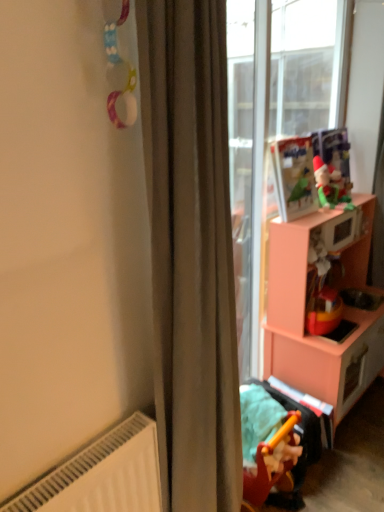
The image size is (384, 512). What do you see at coordinates (330, 186) in the screenshot? I see `matte plastic toy at upper right, acting as the 1th toy starting from the back` at bounding box center [330, 186].

What is the approximate width of yellow plastic toy at lower right, marked as the first toy in a left-to-right arrangement?

yellow plastic toy at lower right, marked as the first toy in a left-to-right arrangement, is 9.42 inches wide.

Describe the element at coordinates (266, 442) in the screenshot. This screenshot has width=384, height=512. I see `yellow plastic toy at lower right, the 2th toy in the back-to-front sequence` at that location.

Identify the location of matte plastic toy at upper right, arranged as the first toy when viewed from the right. Image resolution: width=384 pixels, height=512 pixels. (330, 186).

Where is `the 1st toy to the right of the satin beige curtain at center, starting your count from the anchor`? The image size is (384, 512). the 1st toy to the right of the satin beige curtain at center, starting your count from the anchor is located at coordinates (266, 442).

From the image's perspective, between yellow plastic toy at lower right, marked as the first toy in a left-to-right arrangement, and satin beige curtain at center, which one is located above?

satin beige curtain at center.

Is yellow plastic toy at lower right, which ranks as the 1th toy in bottom-to-top order, oriented towards satin beige curtain at center?

Yes, yellow plastic toy at lower right, which ranks as the 1th toy in bottom-to-top order, is oriented towards satin beige curtain at center.

Based on their sizes in the image, would you say yellow plastic toy at lower right, marked as the second toy in a top-to-bottom arrangement, is bigger or smaller than satin beige curtain at center?

Clearly, yellow plastic toy at lower right, marked as the second toy in a top-to-bottom arrangement, is smaller in size than satin beige curtain at center.

Does point (224, 179) come behind point (318, 178)?

That is False.

Can you tell me how much satin beige curtain at center and matte plastic toy at upper right, the 2th toy viewed from the left, differ in facing direction?

The angle between the facing direction of satin beige curtain at center and the facing direction of matte plastic toy at upper right, the 2th toy viewed from the left, is 1.34 degrees.

Relative to matte plastic toy at upper right, which ranks as the first toy in top-to-bottom order, is satin beige curtain at center in front or behind?

Clearly, satin beige curtain at center is in front of matte plastic toy at upper right, which ranks as the first toy in top-to-bottom order.

From a real-world perspective, which is physically above, satin beige curtain at center or matte plastic toy at upper right, which ranks as the first toy in top-to-bottom order?

From a 3D spatial view, matte plastic toy at upper right, which ranks as the first toy in top-to-bottom order, is above.

From a real-world perspective, is satin beige curtain at center over yellow plastic toy at lower right, the first toy positioned from the front?

Yes.

Between satin beige curtain at center and yellow plastic toy at lower right, marked as the second toy in a top-to-bottom arrangement, which one appears on the right side from the viewer's perspective?

yellow plastic toy at lower right, marked as the second toy in a top-to-bottom arrangement, is more to the right.

Is yellow plastic toy at lower right, marked as the first toy in a left-to-right arrangement, completely or partially inside satin beige curtain at center?

No.

Is yellow plastic toy at lower right, marked as the first toy in a left-to-right arrangement, wider or thinner than matte plastic toy at upper right, which is the 2th toy in bottom-to-top order?

Considering their sizes, yellow plastic toy at lower right, marked as the first toy in a left-to-right arrangement, looks broader than matte plastic toy at upper right, which is the 2th toy in bottom-to-top order.

From a real-world perspective, relative to matte plastic toy at upper right, which ranks as the first toy in top-to-bottom order, is yellow plastic toy at lower right, marked as the first toy in a left-to-right arrangement, vertically above or below?

Clearly, from a real-world perspective, yellow plastic toy at lower right, marked as the first toy in a left-to-right arrangement, is below matte plastic toy at upper right, which ranks as the first toy in top-to-bottom order.

Considering the relative sizes of yellow plastic toy at lower right, the first toy positioned from the front, and matte plastic toy at upper right, which is counted as the 2th toy, starting from the front, in the image provided, is yellow plastic toy at lower right, the first toy positioned from the front, smaller than matte plastic toy at upper right, which is counted as the 2th toy, starting from the front,?

No, yellow plastic toy at lower right, the first toy positioned from the front, is not smaller than matte plastic toy at upper right, which is counted as the 2th toy, starting from the front.

Is matte plastic toy at upper right, arranged as the first toy when viewed from the right, oriented away from pink matte cabinet at right?

No, matte plastic toy at upper right, arranged as the first toy when viewed from the right,'s orientation is not away from pink matte cabinet at right.

Do you think matte plastic toy at upper right, which is the 2th toy in bottom-to-top order, is within pink matte cabinet at right, or outside of it?

matte plastic toy at upper right, which is the 2th toy in bottom-to-top order, is located beyond the bounds of pink matte cabinet at right.

Find the location of a particular element. This screenshot has width=384, height=512. toy located behind the pink matte cabinet at right is located at coordinates (330, 186).

Does point (318, 157) come in front of point (383, 355)?

Yes, point (318, 157) is in front of point (383, 355).

At what (x,y) coordinates should I click in order to perform the action: click on toy lying below the pink matte cabinet at right (from the image's perspective). Please return your answer as a coordinate pair (x, y). The width and height of the screenshot is (384, 512). Looking at the image, I should click on (266, 442).

Can you confirm if yellow plastic toy at lower right, marked as the first toy in a left-to-right arrangement, is thinner than pink matte cabinet at right?

Indeed, yellow plastic toy at lower right, marked as the first toy in a left-to-right arrangement, has a lesser width compared to pink matte cabinet at right.

From a real-world perspective, is yellow plastic toy at lower right, the 2th toy in the back-to-front sequence, physically above pink matte cabinet at right?

No, from a real-world perspective, yellow plastic toy at lower right, the 2th toy in the back-to-front sequence, is not above pink matte cabinet at right.

Considering the relative positions of yellow plastic toy at lower right, the 2th toy in the back-to-front sequence, and pink matte cabinet at right in the image provided, is yellow plastic toy at lower right, the 2th toy in the back-to-front sequence, in front of pink matte cabinet at right?

Yes, it is.

Does point (358, 338) come behind point (339, 176)?

No, it is not.

From the image's perspective, who appears lower, pink matte cabinet at right or matte plastic toy at upper right, which is counted as the 2th toy, starting from the front?

pink matte cabinet at right appears lower in the image.

In the scene shown: Between pink matte cabinet at right and matte plastic toy at upper right, the 2th toy viewed from the left, which one has less height?

matte plastic toy at upper right, the 2th toy viewed from the left.

Is pink matte cabinet at right to the left of matte plastic toy at upper right, which ranks as the first toy in top-to-bottom order, from the viewer's perspective?

No.

The height and width of the screenshot is (512, 384). I want to click on curtain that is above the yellow plastic toy at lower right, marked as the first toy in a left-to-right arrangement (from a real-world perspective), so click(191, 251).

Locate an element on the screen. The image size is (384, 512). curtain below the matte plastic toy at upper right, which ranks as the first toy in top-to-bottom order (from the image's perspective) is located at coordinates (191, 251).

Which object lies further to the anchor point matte plastic toy at upper right, which ranks as the first toy in top-to-bottom order, satin beige curtain at center or pink matte cabinet at right?

satin beige curtain at center is positioned further to the anchor matte plastic toy at upper right, which ranks as the first toy in top-to-bottom order.

From the image, which object appears to be nearer to pink matte cabinet at right, satin beige curtain at center or yellow plastic toy at lower right, marked as the first toy in a left-to-right arrangement?

yellow plastic toy at lower right, marked as the first toy in a left-to-right arrangement.

When comparing their distances from matte plastic toy at upper right, which is counted as the 2th toy, starting from the front, does satin beige curtain at center or yellow plastic toy at lower right, marked as the first toy in a left-to-right arrangement, seem further?

satin beige curtain at center.

From the image, which object appears to be farther from satin beige curtain at center, yellow plastic toy at lower right, marked as the first toy in a left-to-right arrangement, or matte plastic toy at upper right, the 2th toy viewed from the left?

Among the two, matte plastic toy at upper right, the 2th toy viewed from the left, is located further to satin beige curtain at center.

Consider the image. Which object lies further to the anchor point satin beige curtain at center, pink matte cabinet at right or matte plastic toy at upper right, arranged as the first toy when viewed from the right?

matte plastic toy at upper right, arranged as the first toy when viewed from the right, is further to satin beige curtain at center.

Which object lies nearer to the anchor point pink matte cabinet at right, matte plastic toy at upper right, which is the 2th toy in bottom-to-top order, or satin beige curtain at center?

matte plastic toy at upper right, which is the 2th toy in bottom-to-top order, is positioned closer to the anchor pink matte cabinet at right.

Considering their positions, is pink matte cabinet at right positioned further to satin beige curtain at center than yellow plastic toy at lower right, which ranks as the 1th toy in bottom-to-top order?

pink matte cabinet at right.

Looking at this image, looking at the image, which one is located closer to yellow plastic toy at lower right, which is the second toy in right-to-left order, pink matte cabinet at right or matte plastic toy at upper right, acting as the 1th toy starting from the back?

Among the two, pink matte cabinet at right is located nearer to yellow plastic toy at lower right, which is the second toy in right-to-left order.

Where is `cabinetry between matte plastic toy at upper right, which ranks as the first toy in top-to-bottom order, and yellow plastic toy at lower right, which ranks as the 1th toy in bottom-to-top order, vertically`? This screenshot has width=384, height=512. cabinetry between matte plastic toy at upper right, which ranks as the first toy in top-to-bottom order, and yellow plastic toy at lower right, which ranks as the 1th toy in bottom-to-top order, vertically is located at coordinates (316, 335).

In order to click on toy between satin beige curtain at center and pink matte cabinet at right from front to back in this screenshot , I will do `click(266, 442)`.

This screenshot has width=384, height=512. In order to click on toy between satin beige curtain at center and matte plastic toy at upper right, which ranks as the first toy in top-to-bottom order, in the front-back direction in this screenshot , I will do `click(266, 442)`.

In order to click on cabinetry between satin beige curtain at center and matte plastic toy at upper right, arranged as the first toy when viewed from the right, from front to back in this screenshot , I will do `click(316, 335)`.